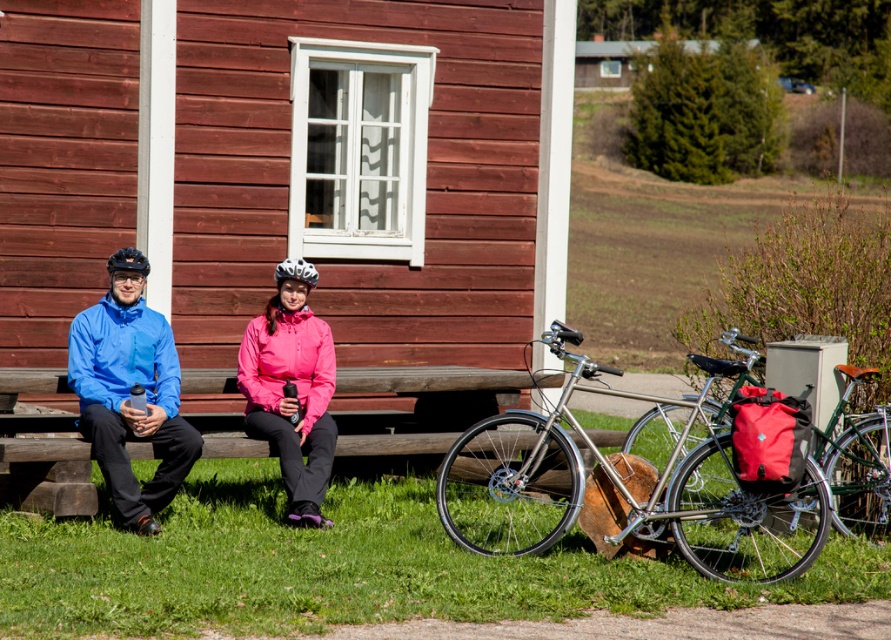
You are a cyclist who wants to retrieve your silver metallic bicycle at lower right. You are currently standing next to the blue waterproof jacket at left. Which direction should you move to reach your bicycle?

The silver metallic bicycle at lower right is located below the blue waterproof jacket at left, so you should move downward or to the right to reach it.

You are standing in front of the rustic red wooden building and want to place a small flowerpot between the two points marked as point (721, 497) and point (885, 500). Which point should the flowerpot be closer to in order to be nearer to the building?

The flowerpot should be closer to point (885, 500) because it is farther from the viewer compared to point (721, 497), meaning it is nearer to the building.